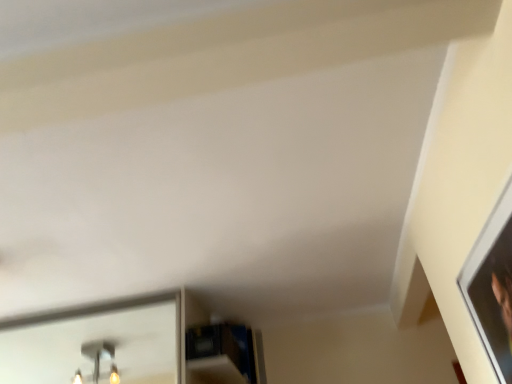
Image resolution: width=512 pixels, height=384 pixels. What do you see at coordinates (222, 351) in the screenshot? I see `matte black shelf at lower center` at bounding box center [222, 351].

The width and height of the screenshot is (512, 384). What are the coordinates of `matte black shelf at lower center` in the screenshot? It's located at (222, 351).

The height and width of the screenshot is (384, 512). In order to click on matte black shelf at lower center in this screenshot , I will do `click(222, 351)`.